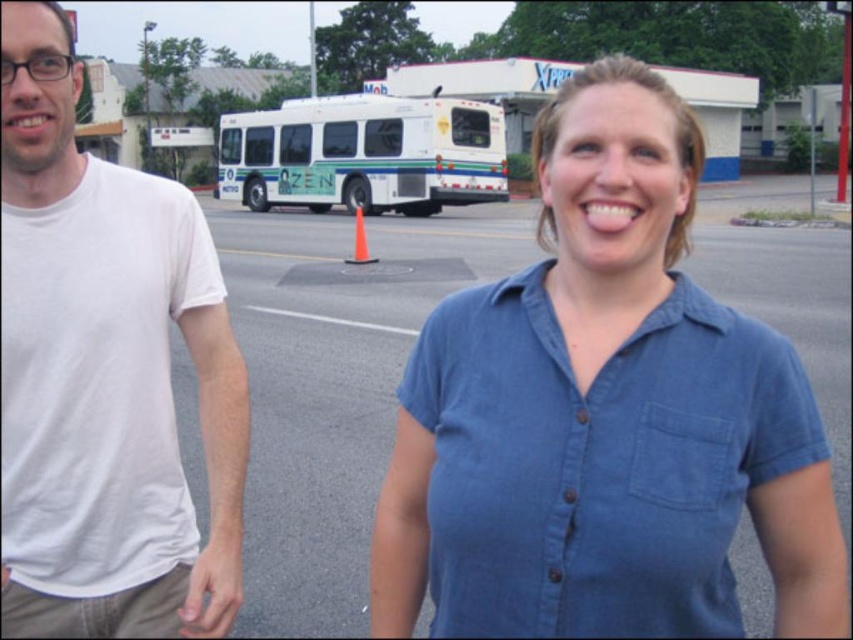
You are a photographer trying to capture a photo of both the denim shirt at center and the white matte bus at center in the same frame. Based on their positions, which one should you focus on first to ensure both are in the shot?

The denim shirt at center is located below the white matte bus at center, so you should focus on the white matte bus at center first to ensure both are in the shot.